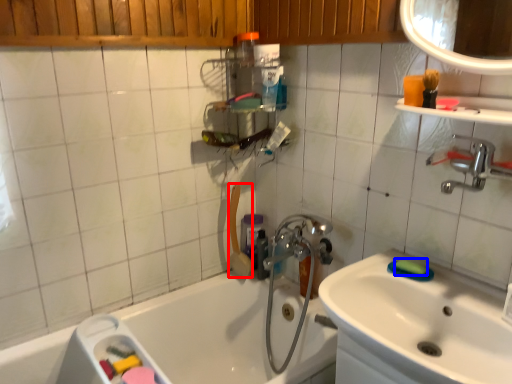
Question: Which of the following is the farthest to the observer, shower (highlighted by a red box) or soap (highlighted by a blue box)?

Choices:
 (A) shower
 (B) soap

Answer: (A)